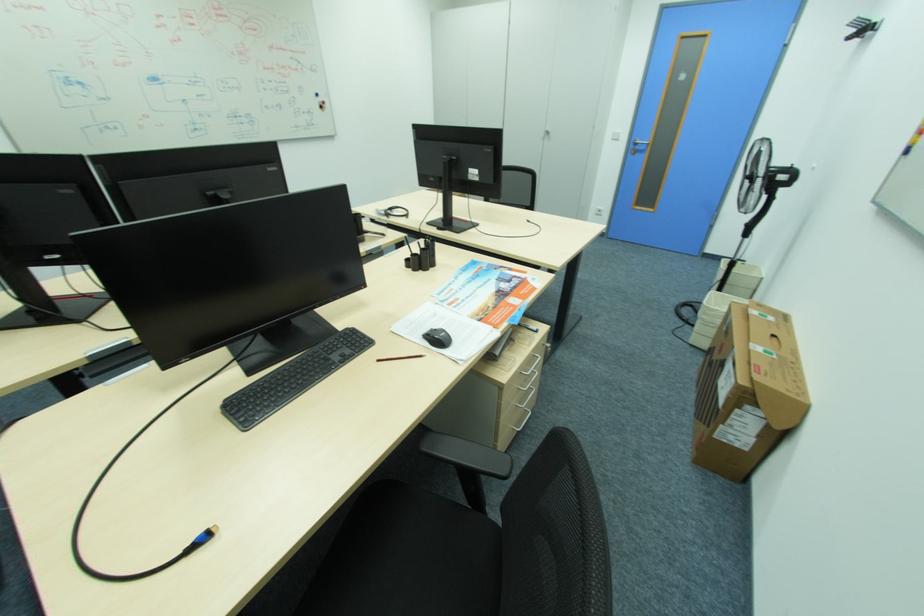
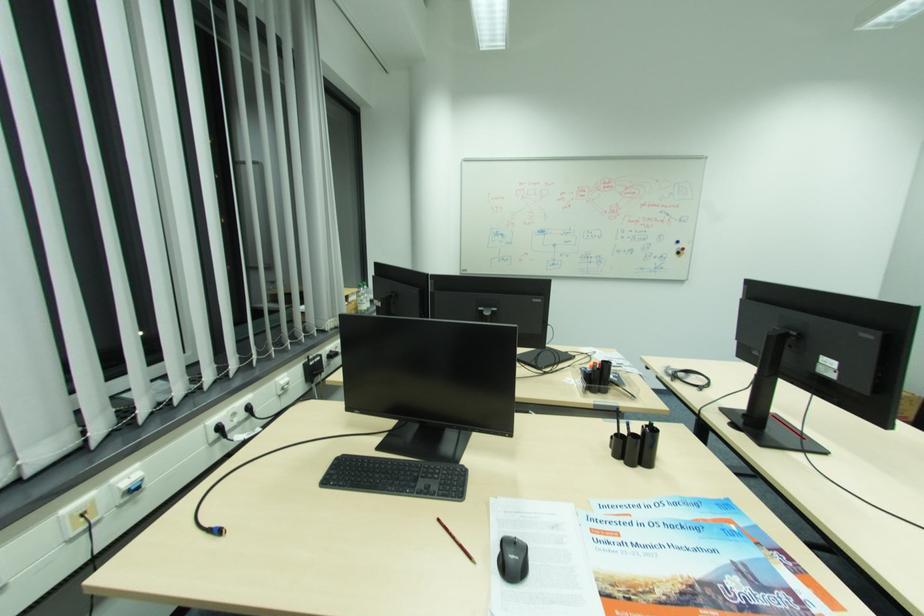
Locate, in the second image, the point that corresponds to point 422,252 in the first image.

(631, 434)